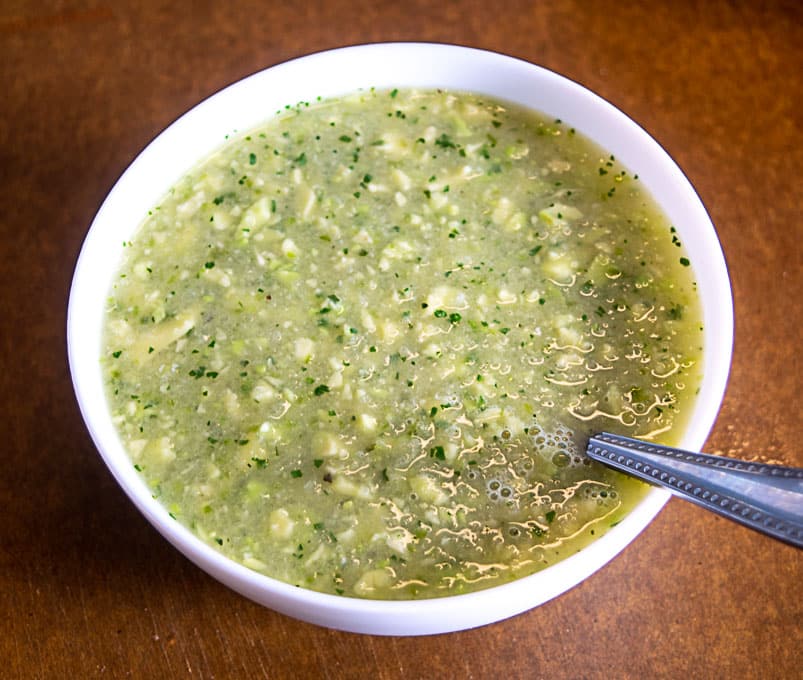
Locate an element on the screen. The image size is (803, 680). spoon handle is located at coordinates (781, 506).